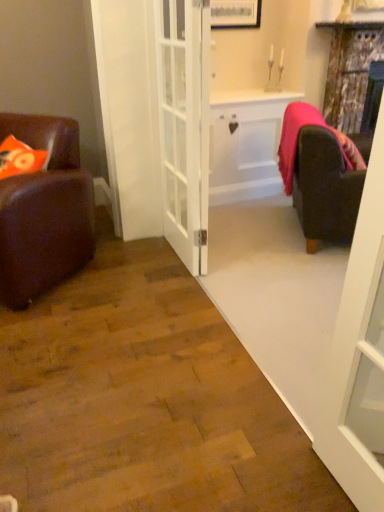
Question: Looking at their shapes, would you say velvet dark brown armchair at right is wider or thinner than brown leather chair at left?

Choices:
 (A) thin
 (B) wide

Answer: (A)

Question: Is velvet dark brown armchair at right inside or outside of brown leather chair at left?

Choices:
 (A) inside
 (B) outside

Answer: (B)

Question: Based on their relative distances, which object is farther from the white matte cabinet at center?

Choices:
 (A) white glass door at center, which is the second door from right to left
 (B) white glass door at right, the second door when ordered from back to front
 (C) distressed wood curtain at upper right
 (D) brown leather chair at left
 (E) velvet dark brown armchair at right

Answer: (B)

Question: Based on their relative distances, which object is farther from the white glass door at right, the 2th door from the left?

Choices:
 (A) white glass door at center, which is counted as the first door, starting from the left
 (B) distressed wood curtain at upper right
 (C) white matte cabinet at center
 (D) brown leather chair at left
 (E) velvet dark brown armchair at right

Answer: (B)